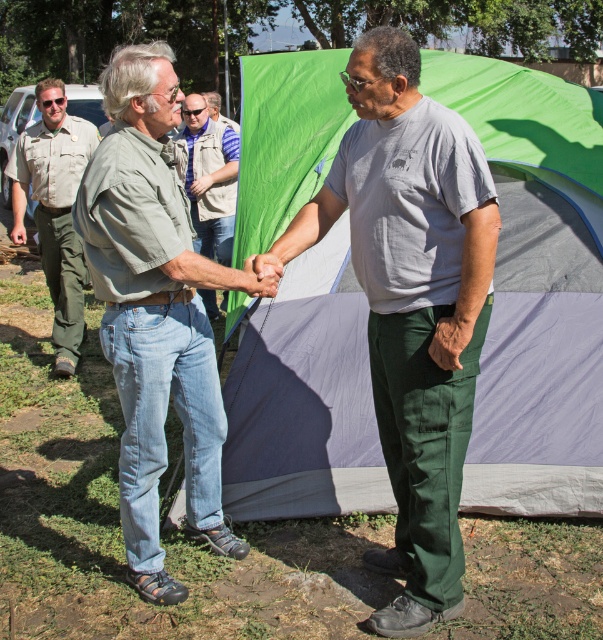
Is gray cotton shirt at center shorter than safari shirt at center?

Incorrect, gray cotton shirt at center's height does not fall short of safari shirt at center's.

Does gray cotton shirt at center come in front of safari shirt at center?

Yes, gray cotton shirt at center is in front of safari shirt at center.

Find the location of a particular element. gray cotton shirt at center is located at coordinates (411, 305).

Locate an element on the screen. gray cotton shirt at center is located at coordinates click(411, 305).

Can you confirm if gray cotton shirt at center is smaller than green denim jeans at center?

Actually, gray cotton shirt at center might be larger than green denim jeans at center.

Between point (440, 193) and point (197, 428), which one is positioned behind?

Positioned behind is point (197, 428).

Identify the location of gray cotton shirt at center. (411, 305).

Can you confirm if green denim jeans at center is bigger than brushed metal uniform at left?

Incorrect, green denim jeans at center is not larger than brushed metal uniform at left.

Consider the image. Which is more to the left, green denim jeans at center or brushed metal uniform at left?

brushed metal uniform at left

You are a GUI agent. You are given a task and a screenshot of the screen. Output one action in this format:
    pyautogui.click(x=<x>, y=<y>)
    Task: Click on the green denim jeans at center
    The image size is (603, 640).
    Given the screenshot: What is the action you would take?
    pyautogui.click(x=156, y=310)

The width and height of the screenshot is (603, 640). Find the location of `green denim jeans at center`. green denim jeans at center is located at coordinates (156, 310).